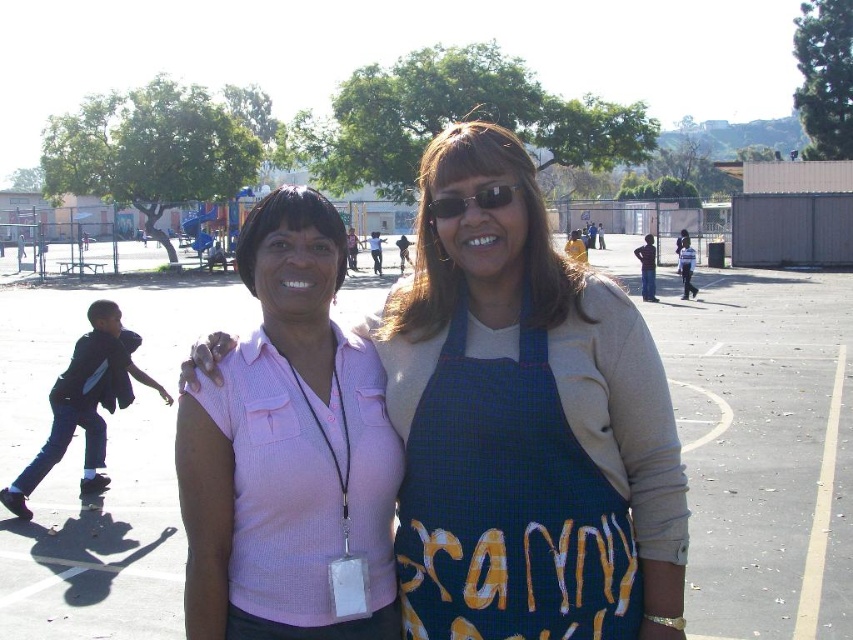
Between pink ribbed shirt at center and sunglasses at center, which one is positioned higher?

sunglasses at center

Which of these two, pink ribbed shirt at center or sunglasses at center, stands taller?

Standing taller between the two is pink ribbed shirt at center.

Image resolution: width=853 pixels, height=640 pixels. In order to click on pink ribbed shirt at center in this screenshot , I will do `click(287, 449)`.

Can you confirm if gray asphalt parking lot at center is thinner than pink ribbed shirt at center?

No, gray asphalt parking lot at center is not thinner than pink ribbed shirt at center.

Can you confirm if gray asphalt parking lot at center is positioned to the right of pink ribbed shirt at center?

Yes, gray asphalt parking lot at center is to the right of pink ribbed shirt at center.

Which is in front, point (833, 323) or point (396, 627)?

Point (396, 627) is more forward.

Where is `gray asphalt parking lot at center`? The width and height of the screenshot is (853, 640). gray asphalt parking lot at center is located at coordinates (759, 444).

Is pink ribbed shirt at center smaller than blue checkered apron at center?

Incorrect, pink ribbed shirt at center is not smaller in size than blue checkered apron at center.

Is pink ribbed shirt at center bigger than blue checkered apron at center?

A: Yes.

Between point (320, 524) and point (497, 467), which one is positioned in front?

Point (497, 467)

What are the coordinates of `pink ribbed shirt at center` in the screenshot? It's located at (287, 449).